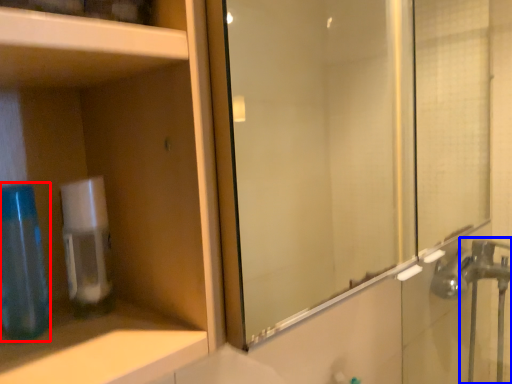
Question: Which of the following is the closest to the observer, mouthwash (highlighted by a red box) or faucet (highlighted by a blue box)?

Choices:
 (A) mouthwash
 (B) faucet

Answer: (A)